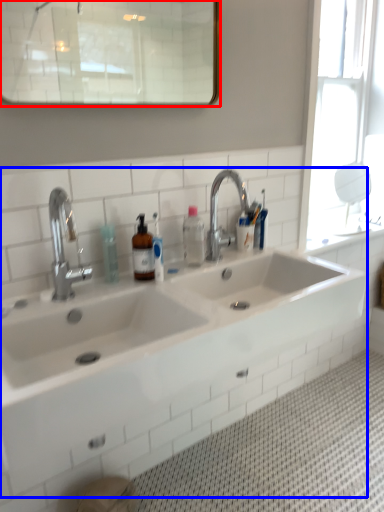
Question: Among these objects, which one is nearest to the camera, mirror (highlighted by a red box) or sink (highlighted by a blue box)?

Choices:
 (A) mirror
 (B) sink

Answer: (B)